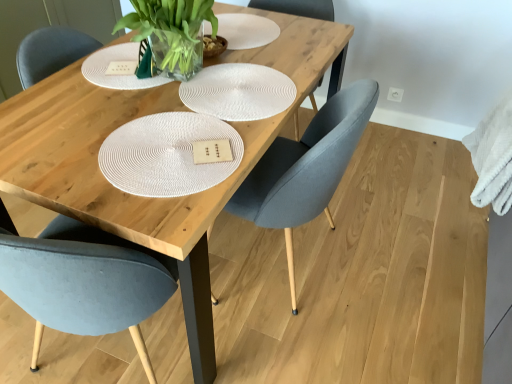
Identify the location of vacant space underneath matte gray chair at center, which appears as the 2th chair when viewed from the left (from a real-world perspective). The image size is (512, 384). (306, 267).